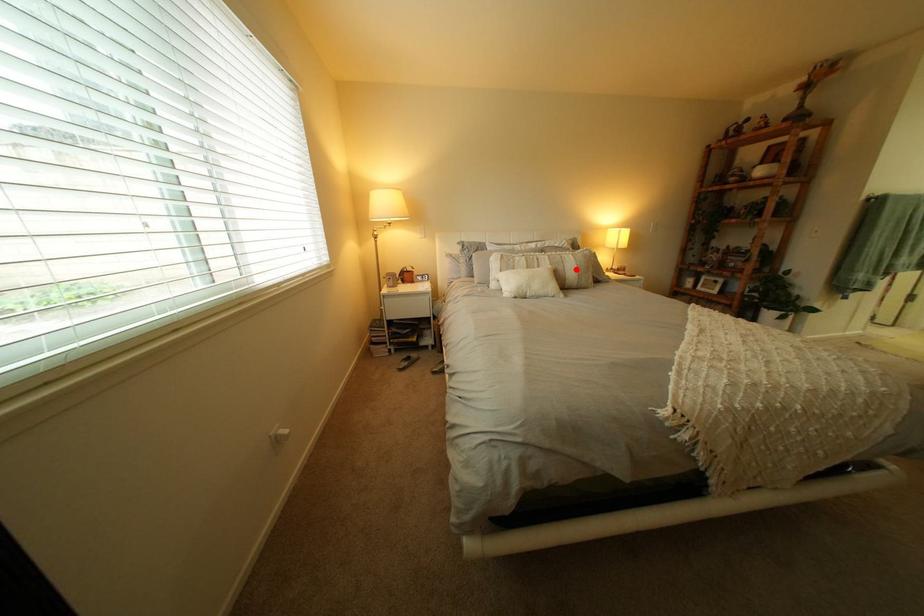
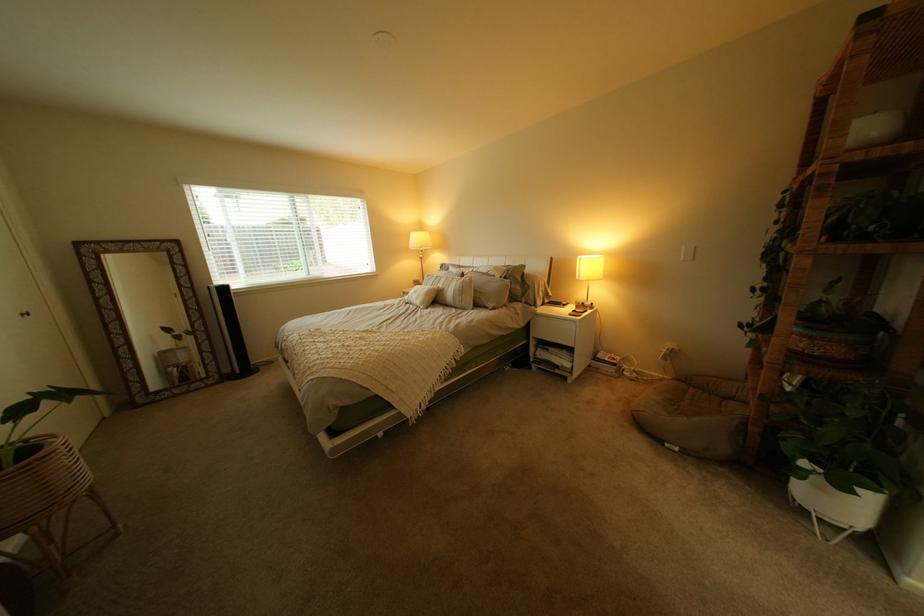
Locate, in the second image, the point that corresponds to the highlighted location in the first image.

(462, 290)